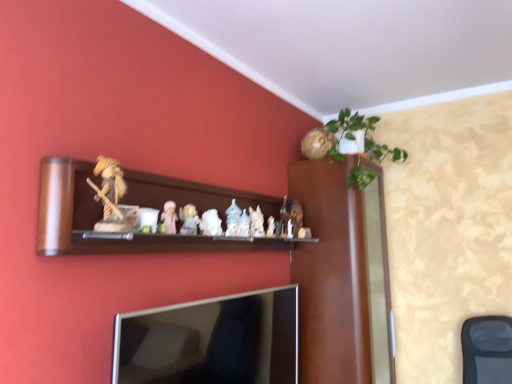
Question: Is wooden shelf at center wider or thinner than silver metallic tv at lower center?

Choices:
 (A) wide
 (B) thin

Answer: (A)

Question: Is wooden shelf at center bigger or smaller than silver metallic tv at lower center?

Choices:
 (A) big
 (B) small

Answer: (A)

Question: Which is nearer to the matte porcelain figurine at center, positioned as the 1th toy in right-to-left order?

Choices:
 (A) black mesh swivel chair at lower right
 (B) green leafy plant at upper right
 (C) wooden shelf at center
 (D) silver metallic tv at lower center
 (E) white porcelain figurine at center, positioned as the second toy in back-to-front order

Answer: (E)

Question: Based on their relative distances, which object is nearer to the matte porcelain figurine at center, positioned as the 6th toy in left-to-right order?

Choices:
 (A) wooden shelf at center
 (B) silver metallic tv at lower center
 (C) black mesh swivel chair at lower right
 (D) white porcelain figurine at center, the fourth toy positioned from the left
 (E) porcelain figurine at center, arranged as the fifth toy when viewed from the right

Answer: (A)